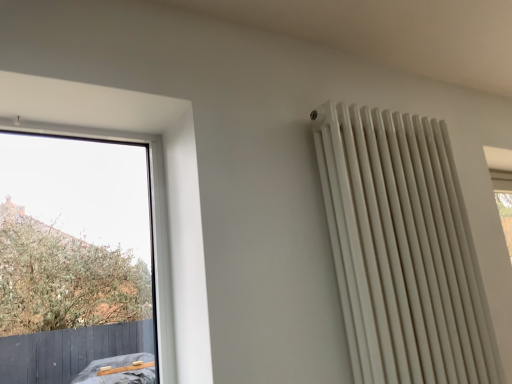
The image size is (512, 384). Describe the element at coordinates (402, 249) in the screenshot. I see `white glossy radiator at upper right` at that location.

I want to click on white glossy radiator at upper right, so [x=402, y=249].

Find the location of a particular element. This screenshot has width=512, height=384. white glossy radiator at upper right is located at coordinates (402, 249).